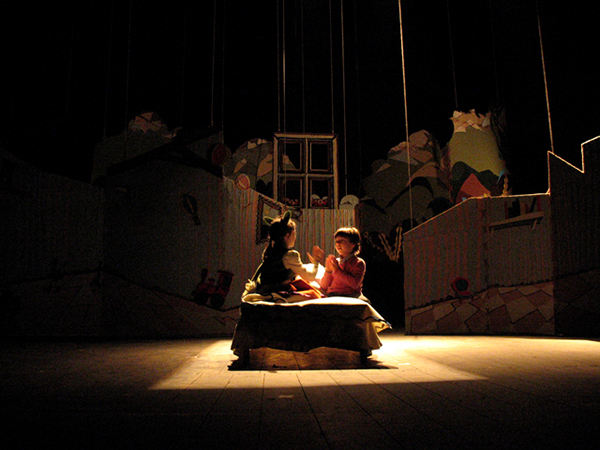
This screenshot has height=450, width=600. In order to click on table in this screenshot , I will do `click(354, 335)`.